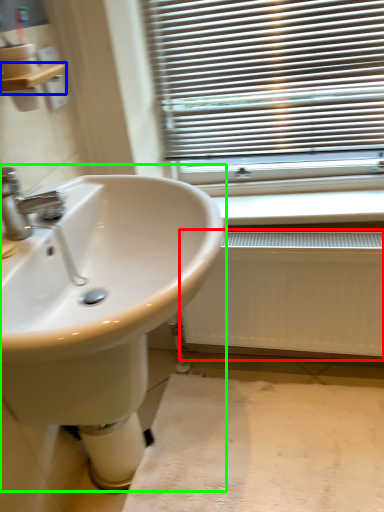
Question: Considering the real-world distances, which object is closest to radiator (highlighted by a red box)? balustrade (highlighted by a blue box) or sink (highlighted by a green box).

Choices:
 (A) balustrade
 (B) sink

Answer: (B)